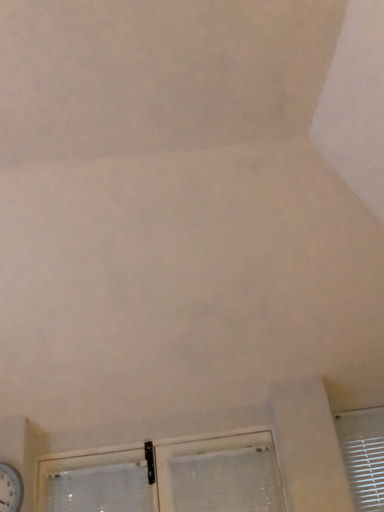
The image size is (384, 512). Find the location of `metallic silver clock at bottom left`. metallic silver clock at bottom left is located at coordinates (10, 489).

In order to face metallic silver clock at bottom left, should I rotate leftwards or rightwards?

You should look left and rotate roughly 25.135 degrees.

This screenshot has height=512, width=384. Describe the element at coordinates (10, 489) in the screenshot. I see `metallic silver clock at bottom left` at that location.

Where is `metallic silver clock at bottom left`? The height and width of the screenshot is (512, 384). metallic silver clock at bottom left is located at coordinates (10, 489).